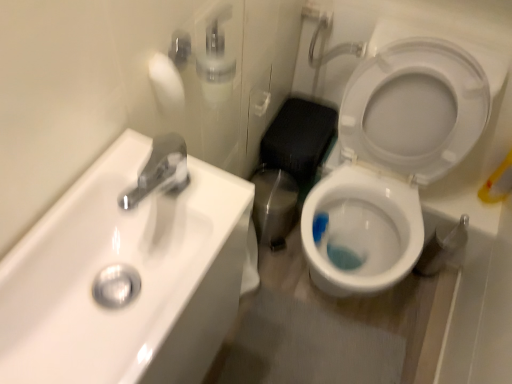
Locate an element on the screen. Image resolution: width=512 pixels, height=384 pixels. free space in front of white glossy toilet at right is located at coordinates (346, 349).